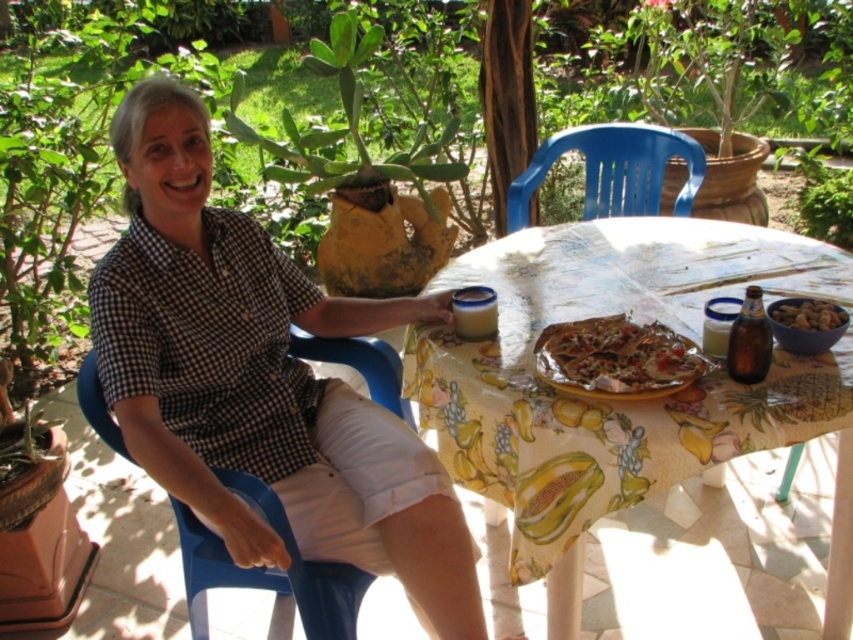
You are a delivery robot with a 1.2 meter wide package. You need to place it between the blue plastic chair at left and the table. Is there enough space?

The distance between the blue plastic chair at left and the viewer is 1.34 meters. Since the package is 1.2 meters wide, there is enough space to place it between the blue plastic chair at left and the table.

You are setting up a picnic and have a small container that can only hold items narrower than the yellow printed tablecloth at center. Can the brown matte nuts at center fit into the container?

The yellow printed tablecloth at center is wider than the brown matte nuts at center. Since the container can only hold items narrower than the tablecloth, the brown matte nuts at center can fit into the container because they are narrower.

You are planning to place a new decorative item on the table in the image. The table is at position coordinates. Where should you place the item to ensure it doesn not block the view of the blue plastic chair at left from the current camera angle?

To avoid blocking the view of the blue plastic chair at left, the decorative item should be placed away from the area near the chair. Since the blue plastic chair at left is located at position coordinates, placing the item on the opposite side of the table or towards the center would keep it out of the viewing path.